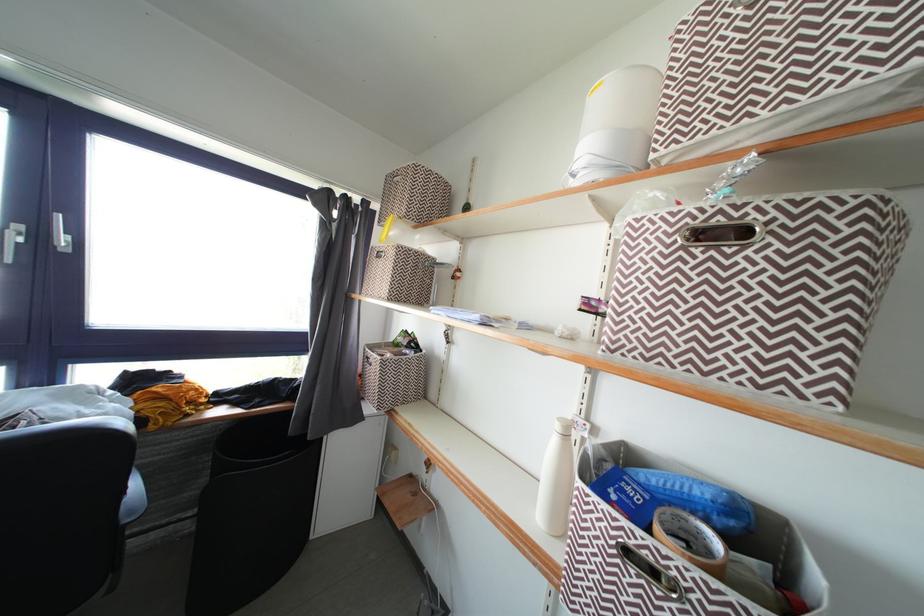
I want to click on silver window handle, so click(x=59, y=233).